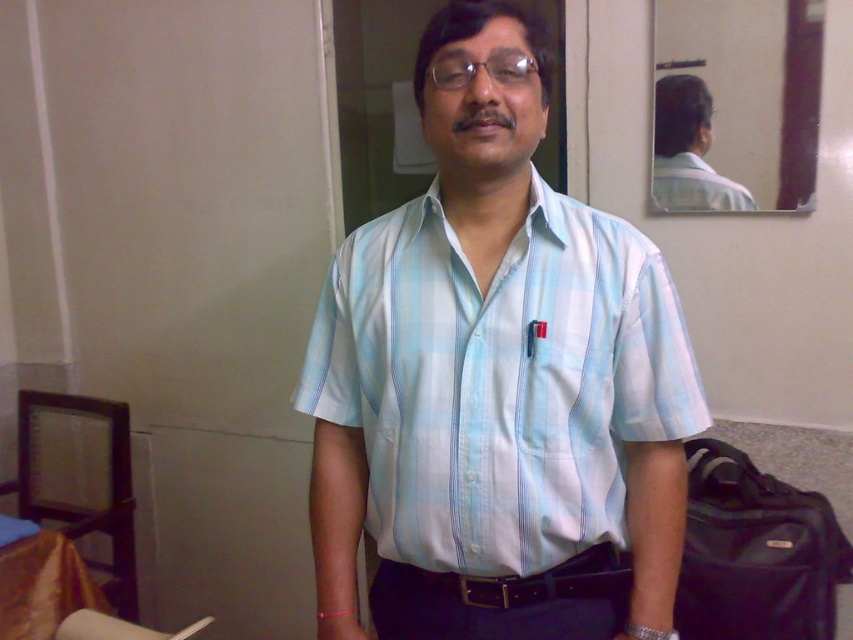
Question: Is light blue plaid shirt at center positioned in front of light blue plaid shirt at upper center?

Choices:
 (A) yes
 (B) no

Answer: (A)

Question: Does black fabric bag at lower right have a smaller size compared to clear plastic glasses at center?

Choices:
 (A) yes
 (B) no

Answer: (B)

Question: Is black fabric bag at lower right in front of clear plastic glasses at center?

Choices:
 (A) yes
 (B) no

Answer: (B)

Question: Which of the following is the closest to the observer?

Choices:
 (A) light blue plaid shirt at upper center
 (B) light blue plaid shirt at center
 (C) black fabric bag at lower right

Answer: (B)

Question: Which is farther from the black fabric bag at lower right?

Choices:
 (A) light blue plaid shirt at upper center
 (B) clear plastic glasses at center
 (C) light blue plaid shirt at center

Answer: (B)

Question: Which of the following is the closest to the observer?

Choices:
 (A) clear plastic glasses at center
 (B) black fabric bag at lower right
 (C) light blue plaid shirt at center

Answer: (C)